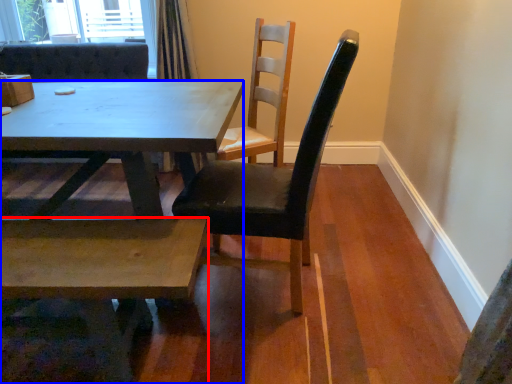
Question: Which object appears farthest to the camera in this image, coffee table (highlighted by a red box) or kitchen & dining room table (highlighted by a blue box)?

Choices:
 (A) coffee table
 (B) kitchen & dining room table

Answer: (B)